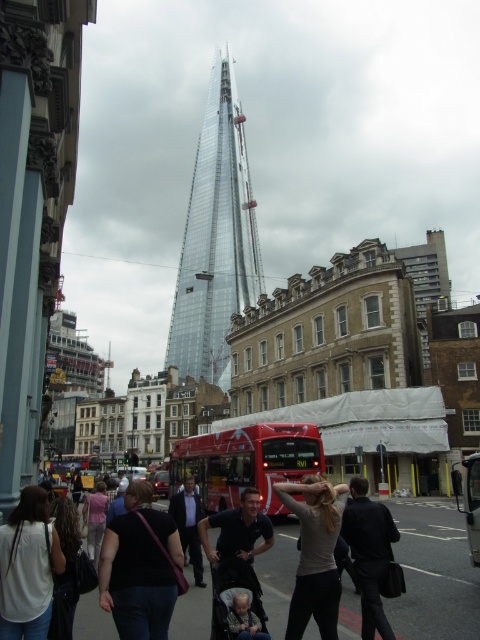
Is transparent glass tower at center positioned in front of light gray fabric at center?

No, it is behind light gray fabric at center.

In the scene shown: Is transparent glass tower at center smaller than light gray fabric at center?

No.

Does point (179, 368) lie in front of point (312, 572)?

That is False.

What are the coordinates of `transparent glass tower at center` in the screenshot? It's located at (216, 237).

Based on the photo, who is positioned more to the left, dark gray suit at center or denim jacket at lower left?

From the viewer's perspective, denim jacket at lower left appears more on the left side.

Is dark gray suit at center wider than denim jacket at lower left?

Incorrect, dark gray suit at center's width does not surpass denim jacket at lower left's.

The width and height of the screenshot is (480, 640). What are the coordinates of `dark gray suit at center` in the screenshot? It's located at (189, 524).

Locate an element on the screen. This screenshot has height=640, width=480. dark gray suit at center is located at coordinates (189, 524).

Between transparent glass tower at center and black fabric purse at lower left, which one has more height?

transparent glass tower at center

Which is behind, point (180, 289) or point (169, 612)?

Positioned behind is point (180, 289).

Find the location of `transparent glass tower at center`. transparent glass tower at center is located at coordinates (216, 237).